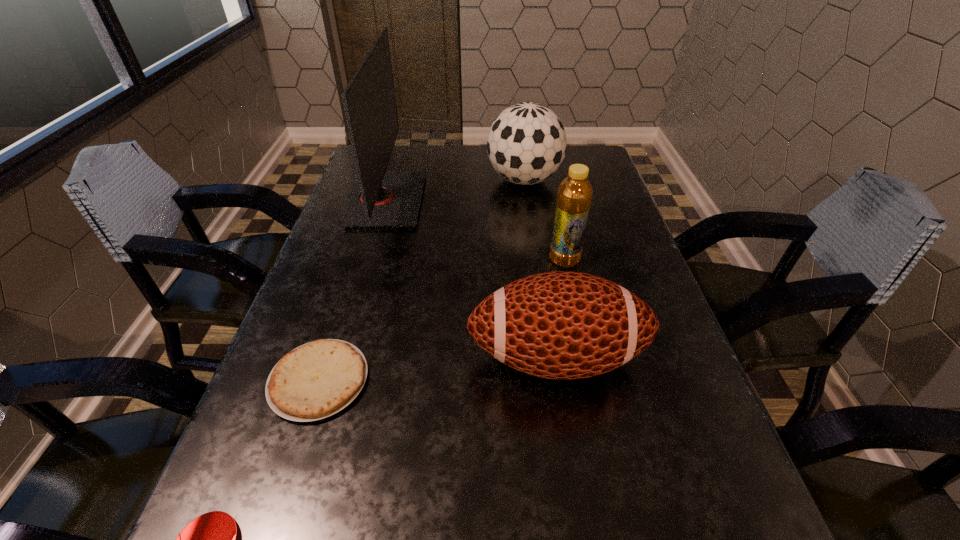
Identify the location of the tallest object. (380, 198).

Where is `bottle`? The image size is (960, 540). bottle is located at coordinates (574, 198).

At what (x,y) coordinates should I click in order to perform the action: click on soccer ball. Please return your answer as a coordinate pair (x, y). The image size is (960, 540). Looking at the image, I should click on (526, 144).

Locate an element on the screen. The width and height of the screenshot is (960, 540). football is located at coordinates (563, 325).

Locate an element on the screen. This screenshot has width=960, height=540. the shortest object is located at coordinates pyautogui.click(x=316, y=380).

This screenshot has height=540, width=960. I want to click on vacant region located on the screen side of the monitor, so click(x=502, y=200).

Where is `vacant space located 0.110m on the front of the bottle`? vacant space located 0.110m on the front of the bottle is located at coordinates (x=574, y=306).

Locate an element on the screen. The image size is (960, 540). vacant space situated on the left of the soccer ball is located at coordinates (365, 180).

Where is `vacant space located on the front of the football`? The image size is (960, 540). vacant space located on the front of the football is located at coordinates (569, 440).

At what (x,y) coordinates should I click in order to perform the action: click on vacant region located 0.330m on the back of the shortest object. Please return your answer as a coordinate pair (x, y). This screenshot has width=960, height=540. Looking at the image, I should click on (365, 238).